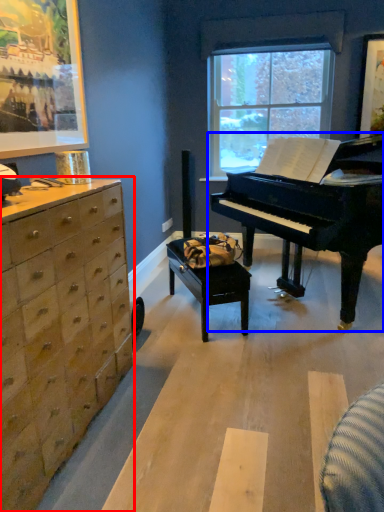
Question: Which of the following is the closest to the observer, chest of drawers (highlighted by a red box) or piano (highlighted by a blue box)?

Choices:
 (A) chest of drawers
 (B) piano

Answer: (A)